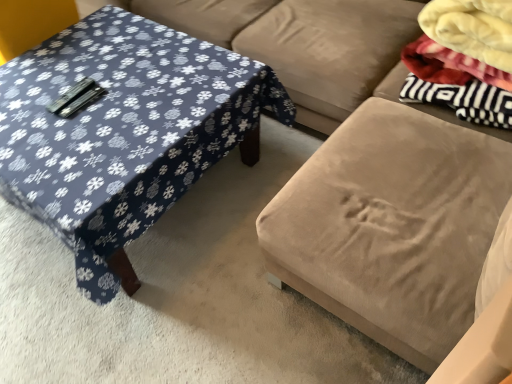
Question: Does velvet beige ottoman at center have a greater height compared to blue fabric-covered table at left?

Choices:
 (A) yes
 (B) no

Answer: (A)

Question: Is velvet beige ottoman at center facing away from blue fabric-covered table at left?

Choices:
 (A) yes
 (B) no

Answer: (B)

Question: Is the depth of velvet beige ottoman at center greater than that of blue fabric-covered table at left?

Choices:
 (A) no
 (B) yes

Answer: (A)

Question: From the image's perspective, is velvet beige ottoman at center under blue fabric-covered table at left?

Choices:
 (A) yes
 (B) no

Answer: (B)

Question: Can you confirm if velvet beige ottoman at center is smaller than blue fabric-covered table at left?

Choices:
 (A) yes
 (B) no

Answer: (B)

Question: Is velvet beige ottoman at center not near blue fabric-covered table at left?

Choices:
 (A) no
 (B) yes

Answer: (A)

Question: Can you confirm if blue fabric-covered table at left is shorter than velvet beige ottoman at center?

Choices:
 (A) no
 (B) yes

Answer: (B)

Question: Is blue fabric-covered table at left oriented towards velvet beige ottoman at center?

Choices:
 (A) no
 (B) yes

Answer: (A)

Question: Is blue fabric-covered table at left positioned in front of velvet beige ottoman at center?

Choices:
 (A) no
 (B) yes

Answer: (A)

Question: Is blue fabric-covered table at left smaller than velvet beige ottoman at center?

Choices:
 (A) yes
 (B) no

Answer: (A)

Question: Is blue fabric-covered table at left looking in the opposite direction of velvet beige ottoman at center?

Choices:
 (A) yes
 (B) no

Answer: (B)

Question: From a real-world perspective, is blue fabric-covered table at left beneath velvet beige ottoman at center?

Choices:
 (A) no
 (B) yes

Answer: (B)

Question: Does blue fabric-covered table at left touch suede couch at center?

Choices:
 (A) yes
 (B) no

Answer: (B)